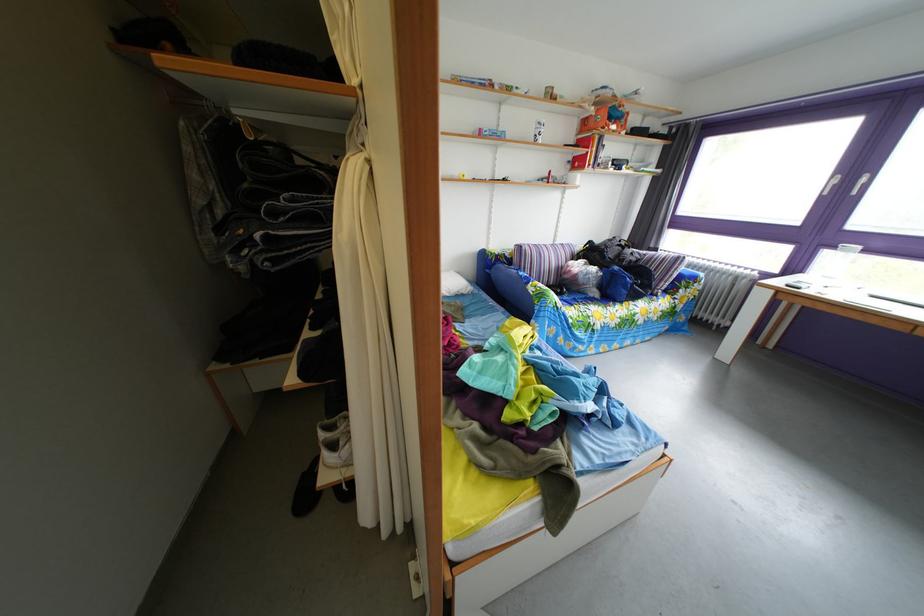
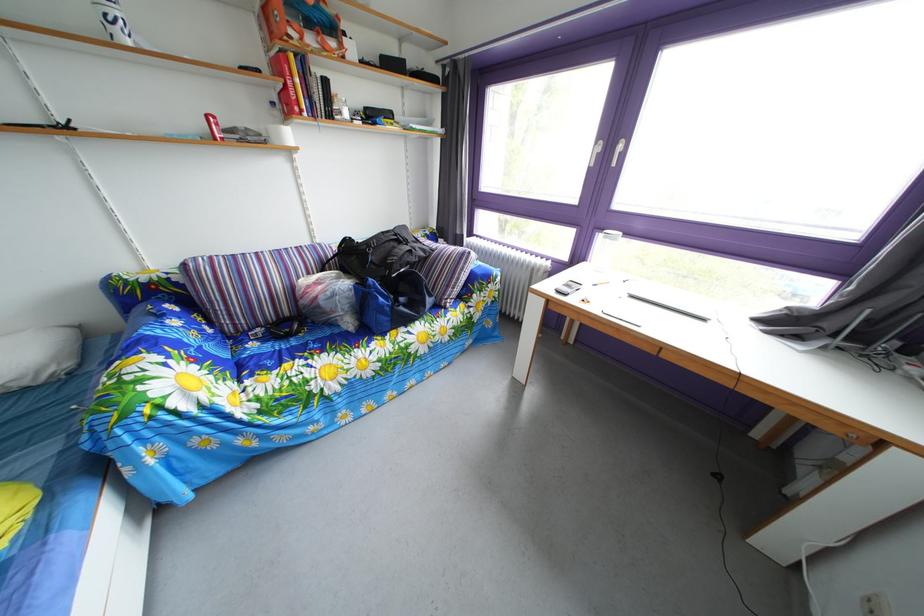
The point at (x=621, y=128) is marked in the first image. Where is the corresponding point in the second image?

(320, 33)